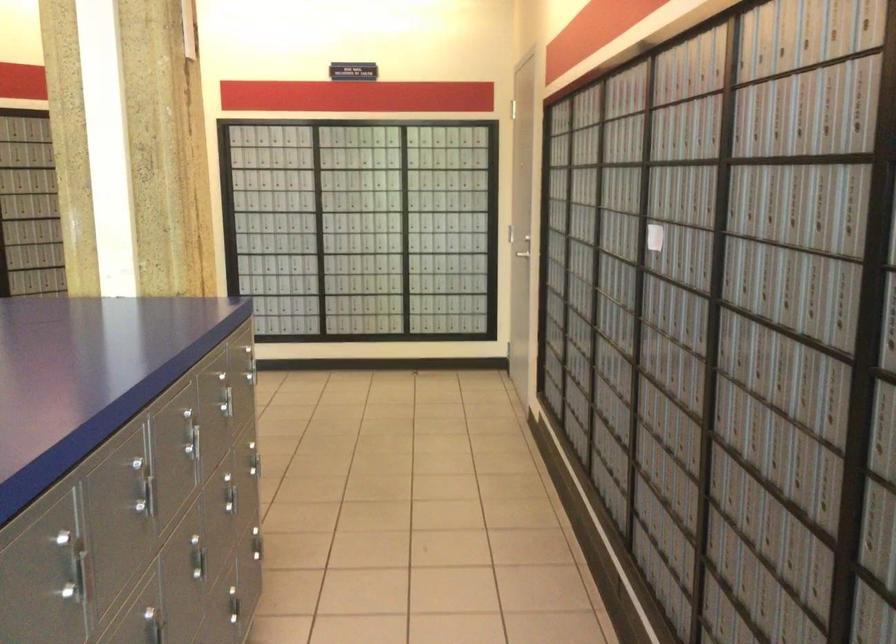
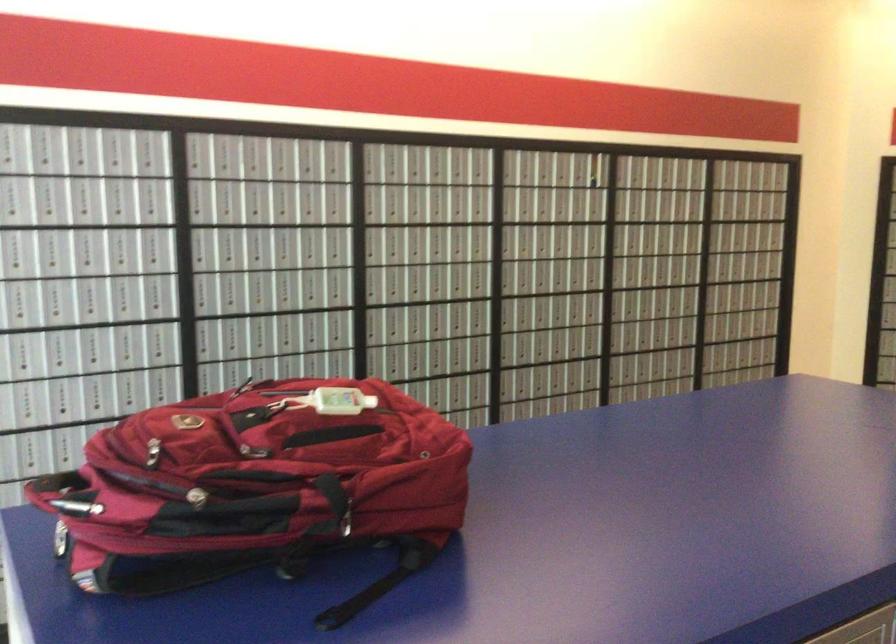
Question: Based on the continuous images, in which direction is the camera rotating? Reply with the corresponding letter.

Choices:
 (A) Left
 (B) Right
 (C) Up
 (D) Down

Answer: (A)